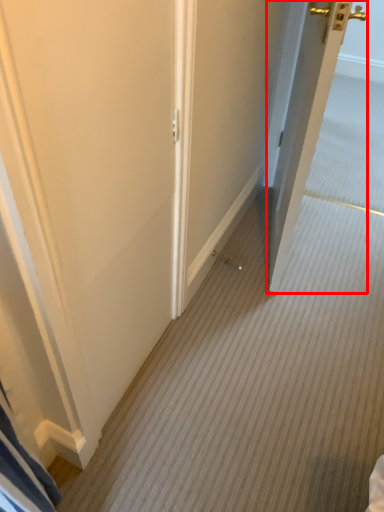
Question: From the image's perspective, where is door (annotated by the red box) located relative to door?

Choices:
 (A) above
 (B) below

Answer: (A)